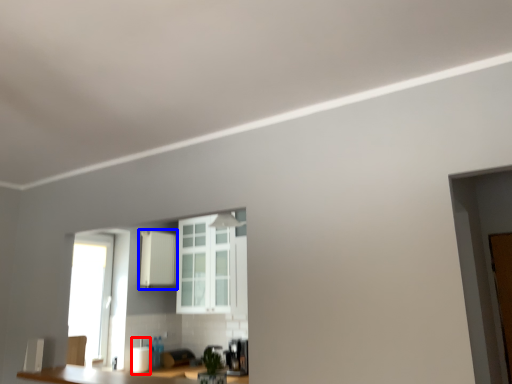
Question: Among these objects, which one is nearest to the camera, appliance (highlighted by a red box) or cabinetry (highlighted by a blue box)?

Choices:
 (A) appliance
 (B) cabinetry

Answer: (A)